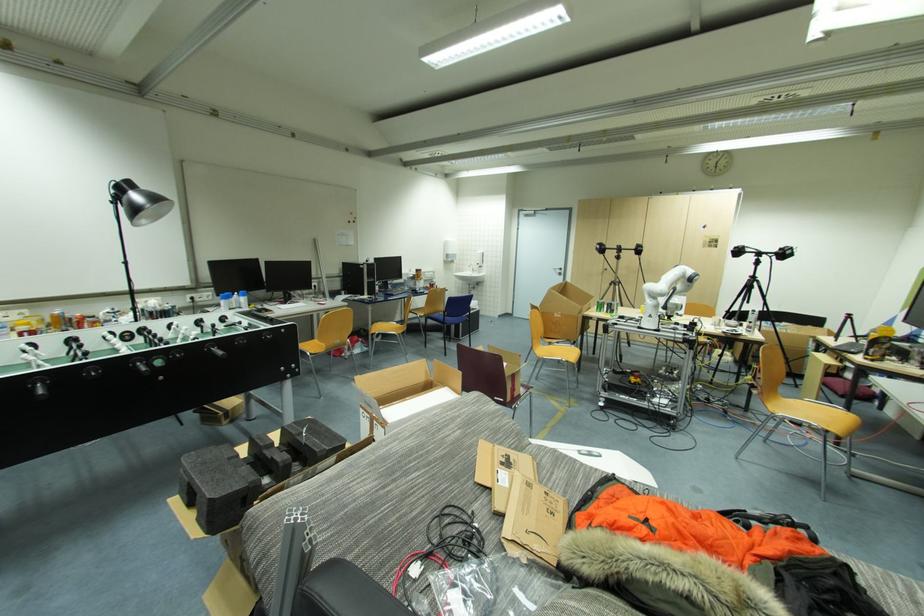
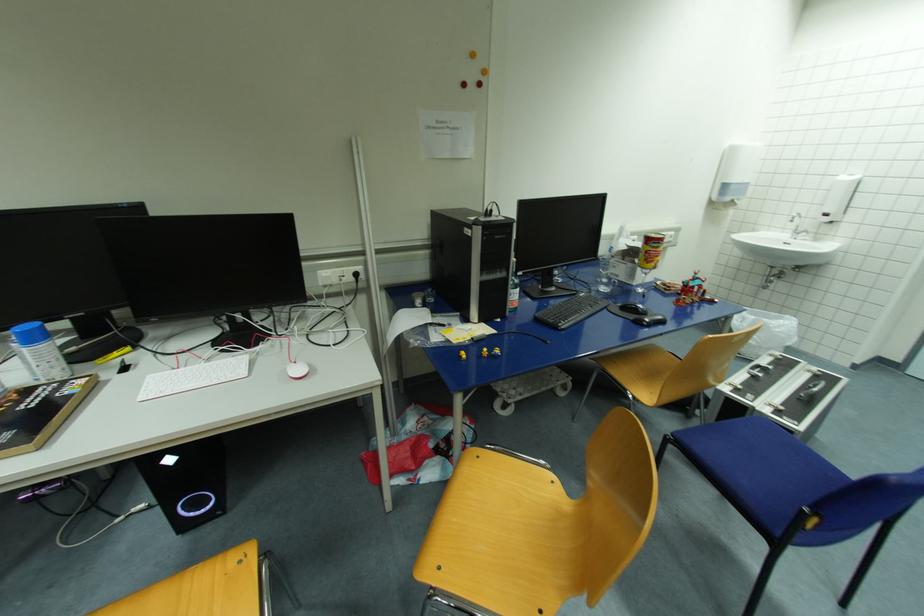
Where in the second image is the point corresponding to [434,284] from the first image?

(696, 285)